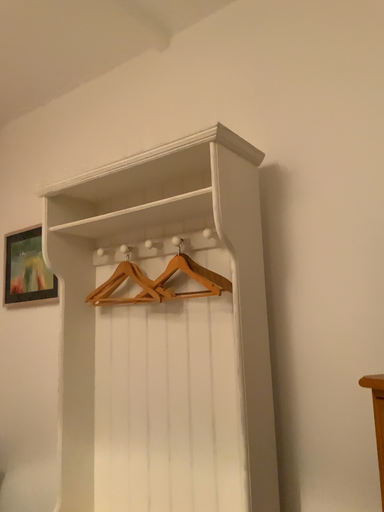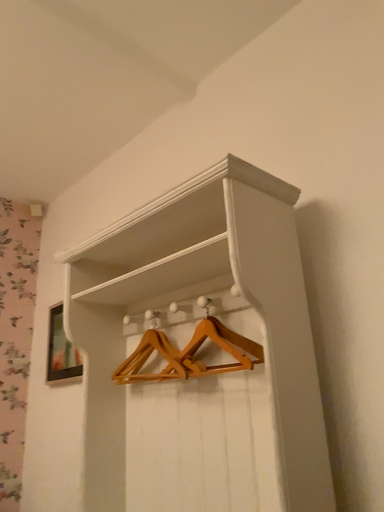
Question: Which way did the camera rotate in the video?

Choices:
 (A) rotated right
 (B) rotated left

Answer: (B)